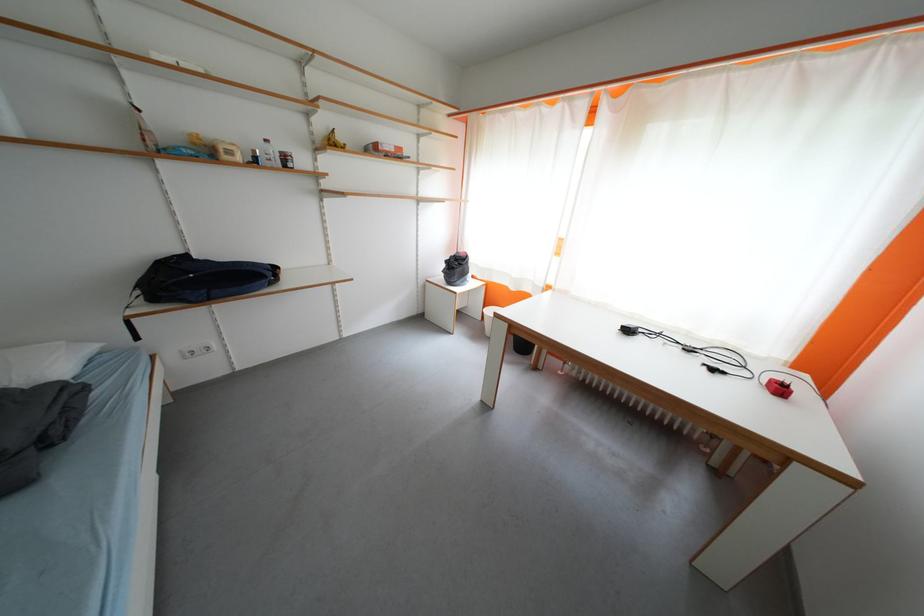
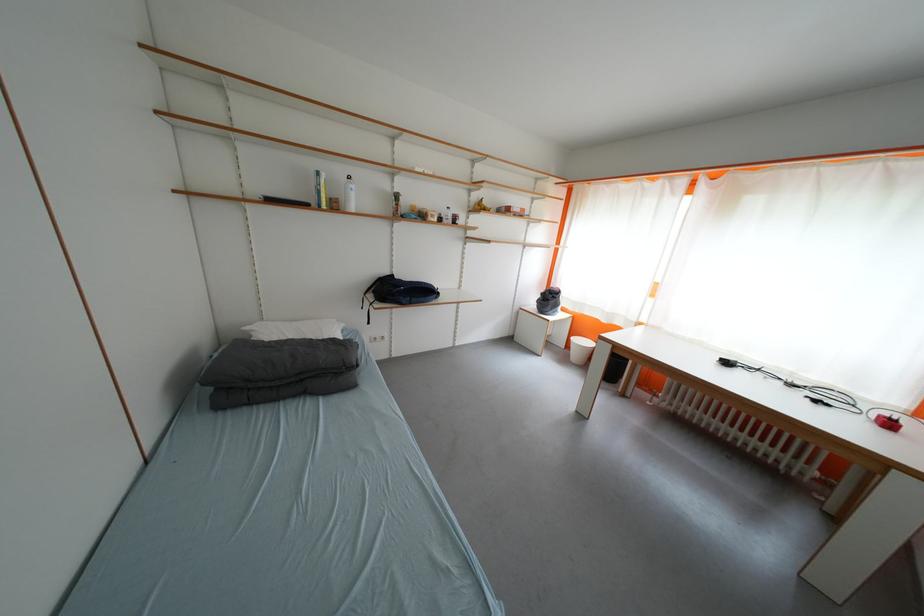
Locate, in the second image, the point that corresponds to pixel 789 392 in the first image.

(897, 428)